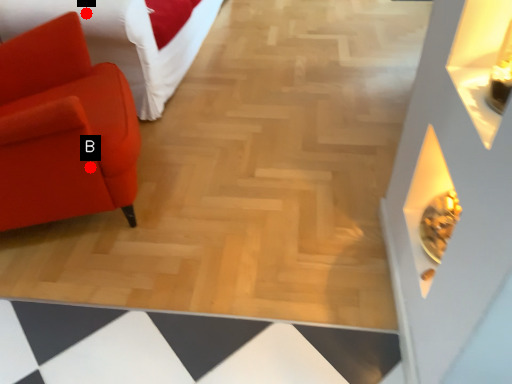
Question: Two points are circled on the image, labeled by A and B beside each circle. Among these points, which one is farthest from the camera?

Choices:
 (A) A is further
 (B) B is further

Answer: (A)